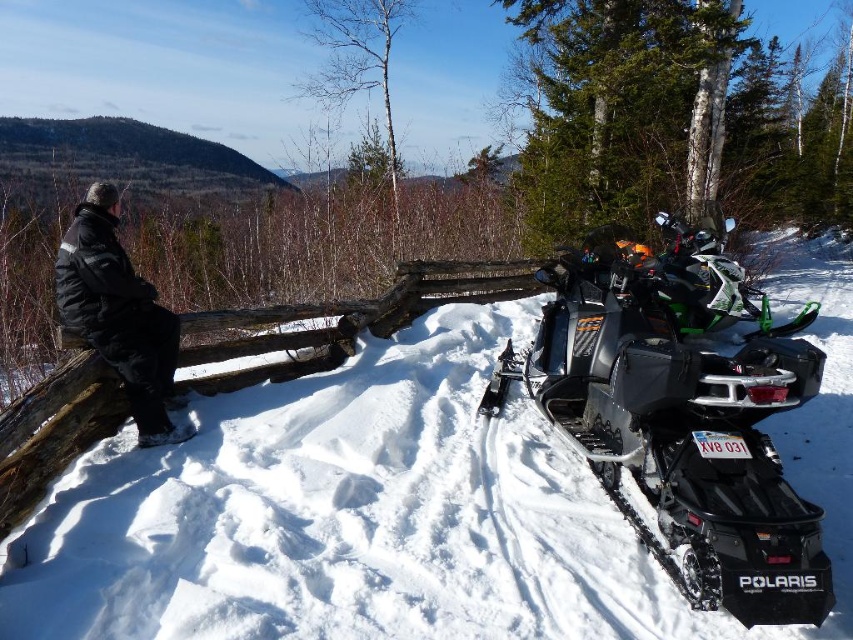
Consider the image. You are a photographer trying to capture the snowmobiles parked to the right of the person leaning against the fence. To ensure both the snowmobiles and the person are in focus, you need to adjust your camera settings. Considering the white fluffy snow at center and the black puffy jacket at left, which object is closer to the camera?

The black puffy jacket at left is closer to the camera because it has a greater height than the white fluffy snow at center, meaning it is positioned nearer to the observer.

You are standing at the center of the snowy area and want to move towards the black puffy jacket at left. Which direction should you go to avoid the black matte snowmobile at right?

Since the black matte snowmobile at right is to the right of the black puffy jacket at left, you should move towards the left to reach the black puffy jacket at left while avoiding the snowmobile.